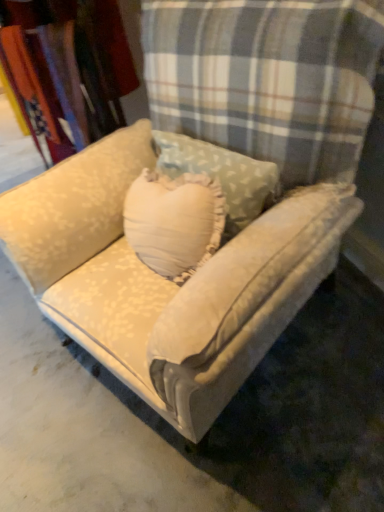
Question: From the image's perspective, is cream floral fabric at upper left beneath velvet beige couch at center?

Choices:
 (A) yes
 (B) no

Answer: (B)

Question: Is cream floral fabric at upper left taller than velvet beige couch at center?

Choices:
 (A) yes
 (B) no

Answer: (B)

Question: Considering the relative sizes of cream floral fabric at upper left and velvet beige couch at center in the image provided, is cream floral fabric at upper left smaller than velvet beige couch at center?

Choices:
 (A) no
 (B) yes

Answer: (B)

Question: Is cream floral fabric at upper left closer to camera compared to velvet beige couch at center?

Choices:
 (A) yes
 (B) no

Answer: (B)

Question: Does cream floral fabric at upper left contain velvet beige couch at center?

Choices:
 (A) yes
 (B) no

Answer: (B)

Question: Is cream floral fabric at upper left beside velvet beige couch at center?

Choices:
 (A) yes
 (B) no

Answer: (B)

Question: Is velvet beige couch at center with cream floral fabric at upper left?

Choices:
 (A) no
 (B) yes

Answer: (A)

Question: From the image's perspective, would you say velvet beige couch at center is shown under cream floral fabric at upper left?

Choices:
 (A) no
 (B) yes

Answer: (B)

Question: Is velvet beige couch at center wider than cream floral fabric at upper left?

Choices:
 (A) yes
 (B) no

Answer: (A)

Question: Is velvet beige couch at center further to the viewer compared to cream floral fabric at upper left?

Choices:
 (A) yes
 (B) no

Answer: (B)

Question: Considering the relative positions of velvet beige couch at center and cream floral fabric at upper left in the image provided, is velvet beige couch at center to the right of cream floral fabric at upper left from the viewer's perspective?

Choices:
 (A) no
 (B) yes

Answer: (B)

Question: From a real-world perspective, is velvet beige couch at center over cream floral fabric at upper left?

Choices:
 (A) no
 (B) yes

Answer: (A)

Question: Is velvet beige couch at center to the left or to the right of cream floral fabric at upper left in the image?

Choices:
 (A) right
 (B) left

Answer: (A)